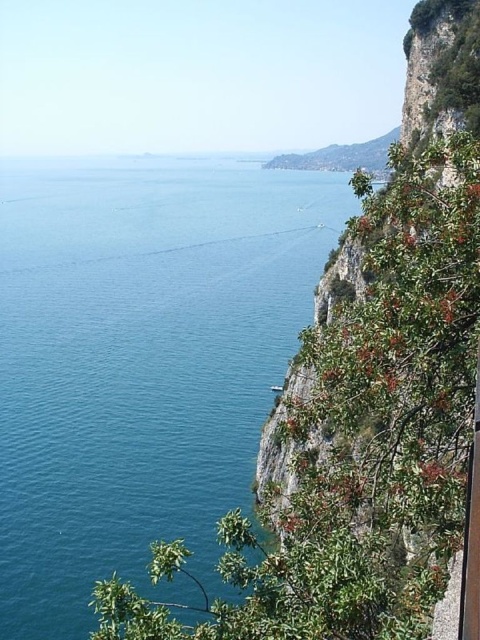
How far apart are blue water at center and green leafy cliff at right?

They are 272.09 feet apart.

Is blue water at center positioned in front of green leafy cliff at right?

No, it is not.

Locate an element on the screen. Image resolution: width=480 pixels, height=640 pixels. blue water at center is located at coordinates (140, 360).